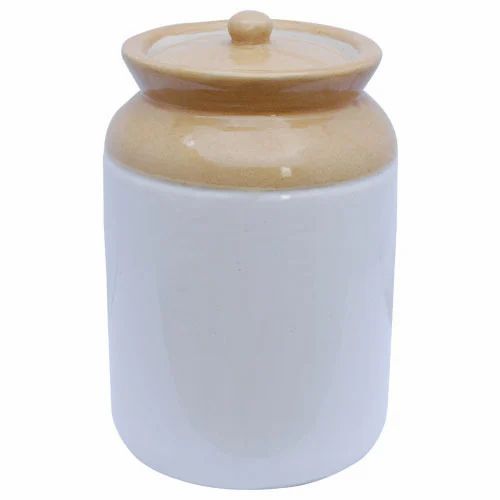
Identify the location of brown jar lid. (209, 56).